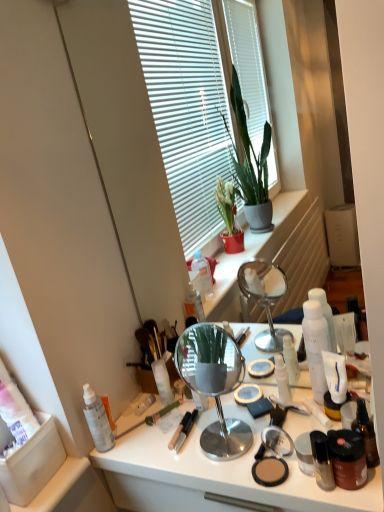
This screenshot has width=384, height=512. In order to click on empty space that is to the right of white plastic container at center, the 6th toiletry when ordered from right to left in this screenshot , I will do `click(228, 402)`.